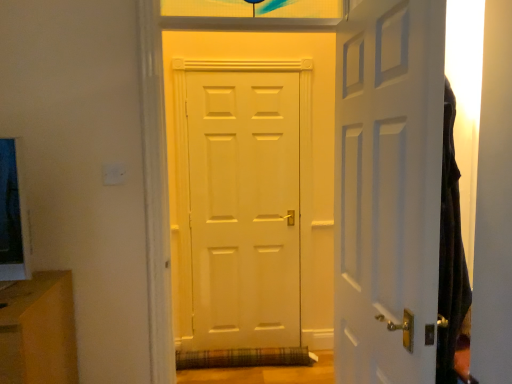
Question: Should I look upward or downward to see white matte door at right, arranged as the 1th door when viewed from the right?

Choices:
 (A) up
 (B) down

Answer: (B)

Question: Which direction should I rotate to face white matte door at center, which is counted as the first door, starting from the left, — up or down?

Choices:
 (A) up
 (B) down

Answer: (B)

Question: From a real-world perspective, is white matte door at center, which is the 2th door from right to left, located higher than white matte door at right, the second door in the left-to-right sequence?

Choices:
 (A) yes
 (B) no

Answer: (A)

Question: Does white matte door at center, which is counted as the first door, starting from the left, lie in front of white matte door at right, arranged as the 1th door when viewed from the right?

Choices:
 (A) no
 (B) yes

Answer: (A)

Question: Considering the relative sizes of white matte door at center, which is the 2th door from right to left, and white matte door at right, arranged as the 1th door when viewed from the right, in the image provided, is white matte door at center, which is the 2th door from right to left, bigger than white matte door at right, arranged as the 1th door when viewed from the right,?

Choices:
 (A) yes
 (B) no

Answer: (A)

Question: From the image's perspective, is white matte door at center, which is the 2th door from right to left, located beneath white matte door at right, arranged as the 1th door when viewed from the right?

Choices:
 (A) no
 (B) yes

Answer: (A)

Question: Considering the relative sizes of white matte door at center, which is counted as the first door, starting from the left, and white matte door at right, arranged as the 1th door when viewed from the right, in the image provided, is white matte door at center, which is counted as the first door, starting from the left, thinner than white matte door at right, arranged as the 1th door when viewed from the right,?

Choices:
 (A) yes
 (B) no

Answer: (B)

Question: Could you tell me if white matte door at center, which is the 2th door from right to left, is facing white matte door at right, arranged as the 1th door when viewed from the right?

Choices:
 (A) no
 (B) yes

Answer: (B)

Question: Considering the relative positions of white matte door at right, the second door in the left-to-right sequence, and white matte door at center, which is counted as the first door, starting from the left, in the image provided, is white matte door at right, the second door in the left-to-right sequence, in front of white matte door at center, which is counted as the first door, starting from the left,?

Choices:
 (A) no
 (B) yes

Answer: (B)

Question: Is white matte door at center, which is the 2th door from right to left, at the back of white matte door at right, arranged as the 1th door when viewed from the right?

Choices:
 (A) no
 (B) yes

Answer: (A)

Question: From the image's perspective, is white matte door at right, arranged as the 1th door when viewed from the right, beneath white matte door at center, which is counted as the first door, starting from the left?

Choices:
 (A) yes
 (B) no

Answer: (A)

Question: Is the depth of white matte door at right, arranged as the 1th door when viewed from the right, greater than that of white matte door at center, which is counted as the first door, starting from the left?

Choices:
 (A) no
 (B) yes

Answer: (A)

Question: Is white matte door at right, arranged as the 1th door when viewed from the right, completely or partially outside of white matte door at center, which is the 2th door from right to left?

Choices:
 (A) no
 (B) yes

Answer: (B)

Question: From a real-world perspective, is white matte door at right, arranged as the 1th door when viewed from the right, beneath white matte door at center, which is counted as the first door, starting from the left?

Choices:
 (A) yes
 (B) no

Answer: (A)

Question: In the image, is white matte door at center, which is the 2th door from right to left, positioned in front of or behind white matte door at right, arranged as the 1th door when viewed from the right?

Choices:
 (A) front
 (B) behind

Answer: (B)